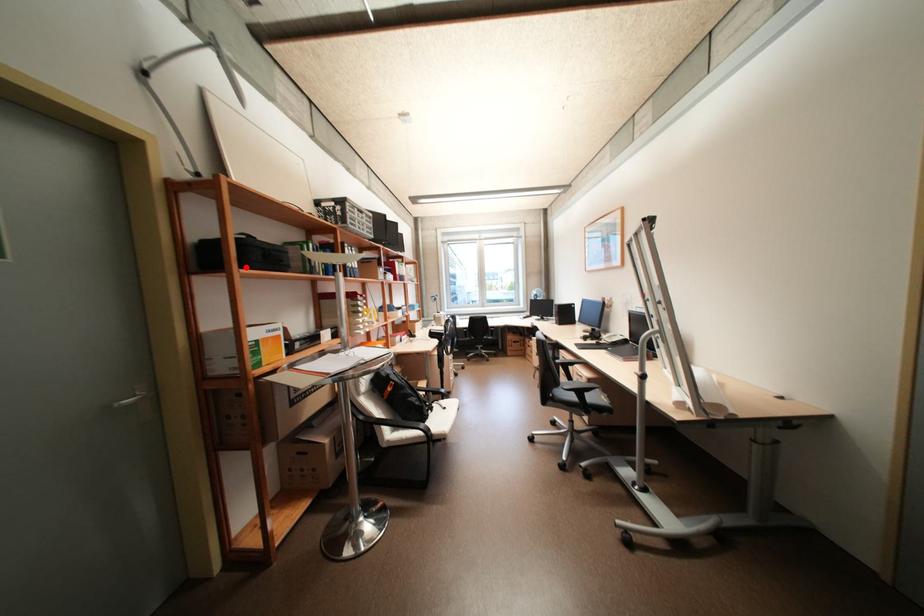
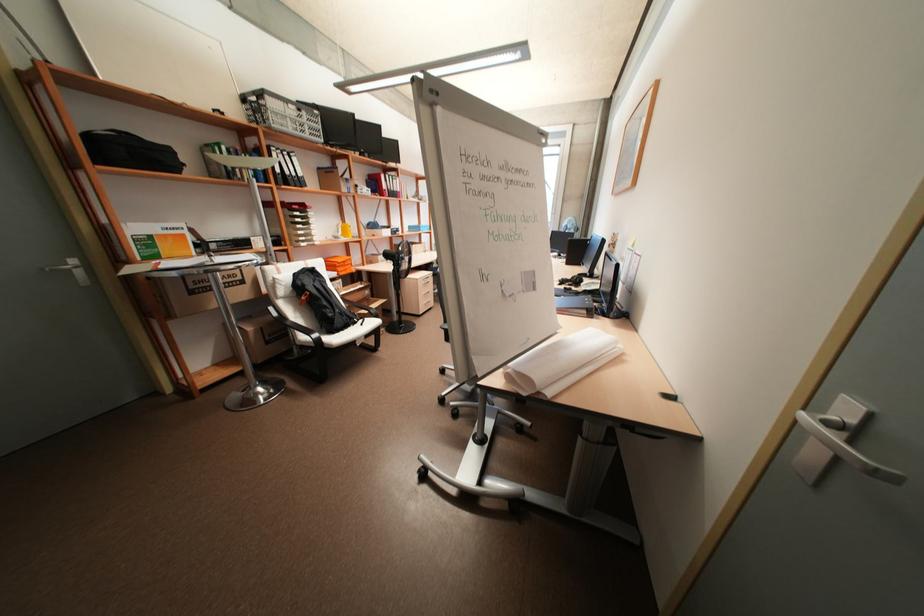
Where in the second image is the point corresponding to the highlighted location from the first image?

(102, 163)